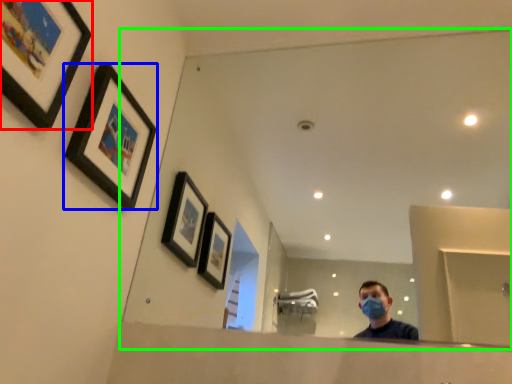
Question: Based on their relative distances, which object is farther from picture frame (highlighted by a red box)? Choose from picture frame (highlighted by a blue box) and mirror (highlighted by a green box).

Choices:
 (A) picture frame
 (B) mirror

Answer: (B)